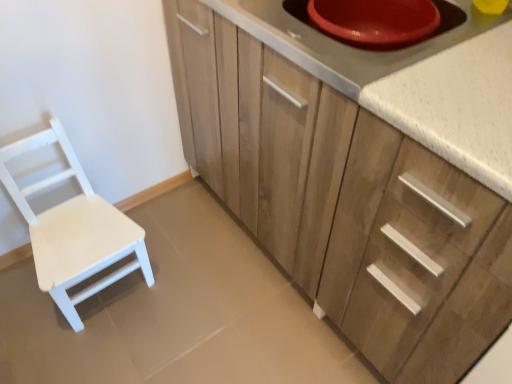
Question: Considering the positions of white matte wood chair at left and wooden cabinet at center in the image, is white matte wood chair at left bigger or smaller than wooden cabinet at center?

Choices:
 (A) big
 (B) small

Answer: (B)

Question: From the image's perspective, is white matte wood chair at left located above or below wooden cabinet at center?

Choices:
 (A) below
 (B) above

Answer: (A)

Question: Based on their relative distances, which object is nearer to the white speckled countertop at upper right?

Choices:
 (A) white matte wood chair at left
 (B) red plastic bowl at upper right
 (C) wooden cabinet at center

Answer: (B)

Question: Which object is the farthest from the white matte wood chair at left?

Choices:
 (A) white speckled countertop at upper right
 (B) wooden cabinet at center
 (C) red plastic bowl at upper right

Answer: (A)